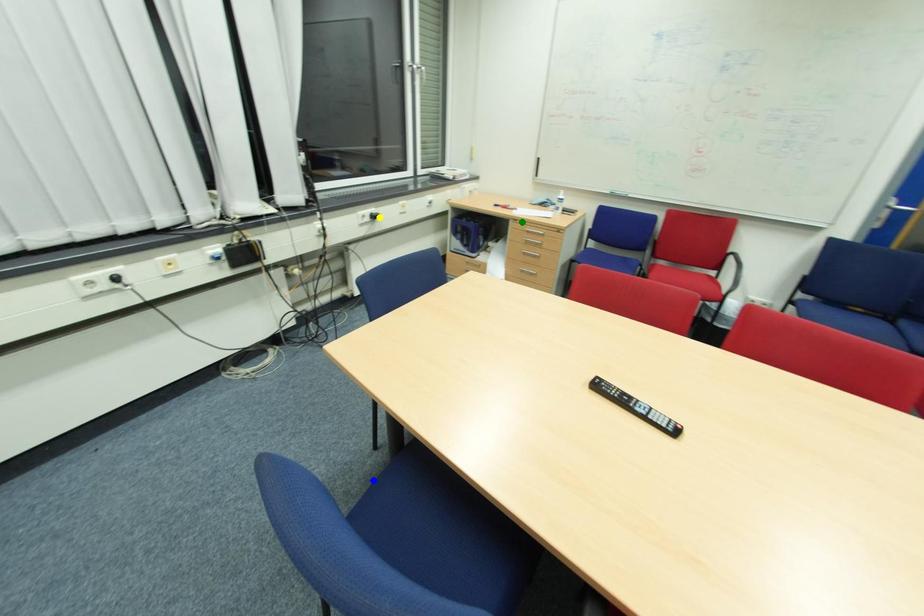
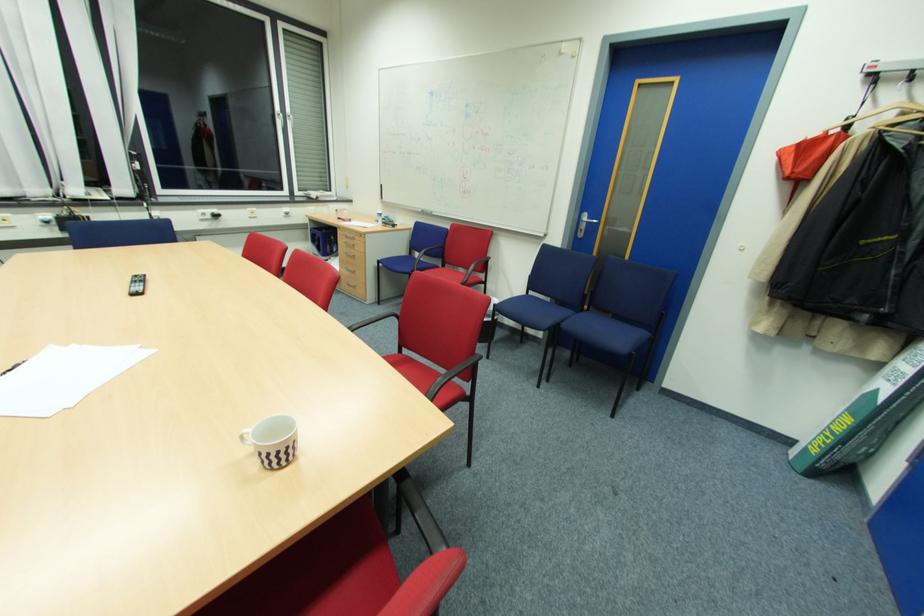
I am providing you with two images of the same scene from different viewpoints. Three points are marked in image1. Which point corresponds to a part or object that is occluded in image2?In image1, three points are marked. Which of them correspond to a part or object that is occluded in image2?Among the three points shown in image1, which one corresponds to a part or object that is no longer visible due to occlusion in image2?

blue point cannot be seen in image2.